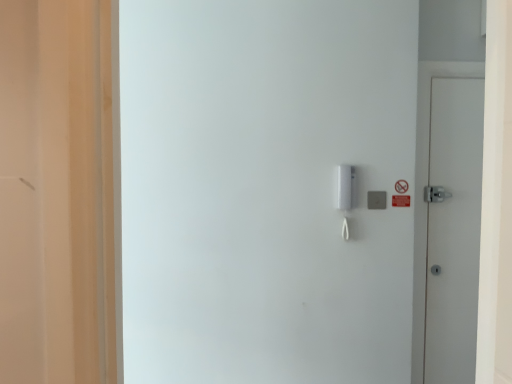
Question: Should I look upward or downward to see white matte door at right?

Choices:
 (A) up
 (B) down

Answer: (B)

Question: Is white plastic intercom at center-right not within white matte door at right?

Choices:
 (A) no
 (B) yes

Answer: (B)

Question: Considering the relative sizes of white plastic intercom at center-right and white matte door at right in the image provided, is white plastic intercom at center-right shorter than white matte door at right?

Choices:
 (A) yes
 (B) no

Answer: (A)

Question: Can you confirm if white plastic intercom at center-right is bigger than white matte door at right?

Choices:
 (A) yes
 (B) no

Answer: (A)

Question: Could white matte door at right be considered to be inside white plastic intercom at center-right?

Choices:
 (A) yes
 (B) no

Answer: (B)

Question: Can you confirm if white plastic intercom at center-right is wider than white matte door at right?

Choices:
 (A) no
 (B) yes

Answer: (B)

Question: Is the depth of white plastic intercom at center-right greater than that of white matte door at right?

Choices:
 (A) yes
 (B) no

Answer: (B)

Question: Does white plastic intercom at center-right have a larger size compared to gray matte/light switch at center-right?

Choices:
 (A) yes
 (B) no

Answer: (A)

Question: From the image's perspective, is white plastic intercom at center-right below gray matte/light switch at center-right?

Choices:
 (A) yes
 (B) no

Answer: (B)

Question: From the image's perspective, is white plastic intercom at center-right on gray matte/light switch at center-right?

Choices:
 (A) no
 (B) yes

Answer: (B)

Question: Is white plastic intercom at center-right beside gray matte/light switch at center-right?

Choices:
 (A) no
 (B) yes

Answer: (A)

Question: Is white plastic intercom at center-right turned away from gray matte/light switch at center-right?

Choices:
 (A) no
 (B) yes

Answer: (B)

Question: Is white plastic intercom at center-right positioned behind gray matte/light switch at center-right?

Choices:
 (A) yes
 (B) no

Answer: (B)

Question: From a real-world perspective, does gray matte/light switch at center-right sit lower than white plastic intercom at center-right?

Choices:
 (A) no
 (B) yes

Answer: (B)